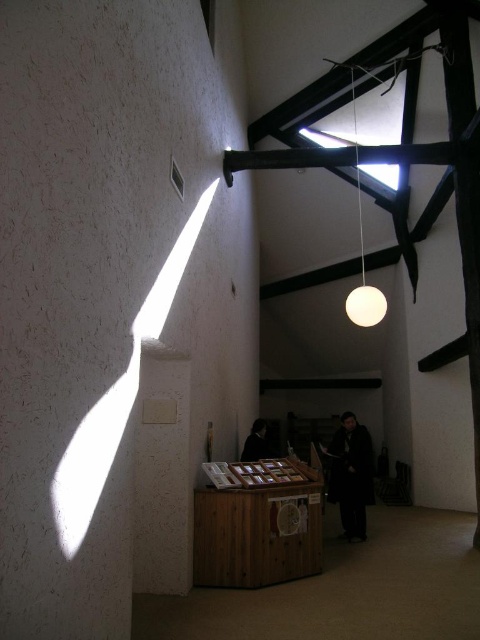
Question: Is white textured pillar at center wider than dark brown leather jacket at center?

Choices:
 (A) yes
 (B) no

Answer: (A)

Question: Does white matte sphere at upper center appear on the left side of matte white sphere at upper center?

Choices:
 (A) no
 (B) yes

Answer: (B)

Question: Is white textured pillar at left behind white matte sphere at upper center?

Choices:
 (A) no
 (B) yes

Answer: (A)

Question: Which point appears farthest from the camera in this image?

Choices:
 (A) (336, 429)
 (B) (136, 435)

Answer: (A)

Question: Estimate the real-world distances between objects in this image. Which object is closer to the matte white sphere at upper center?

Choices:
 (A) dark brown leather jacket at center
 (B) dark wool coat at center
 (C) white textured pillar at left
 (D) white textured pillar at center

Answer: (B)

Question: Which is farther from the dark brown leather jacket at center?

Choices:
 (A) white matte sphere at upper center
 (B) white textured pillar at left

Answer: (B)